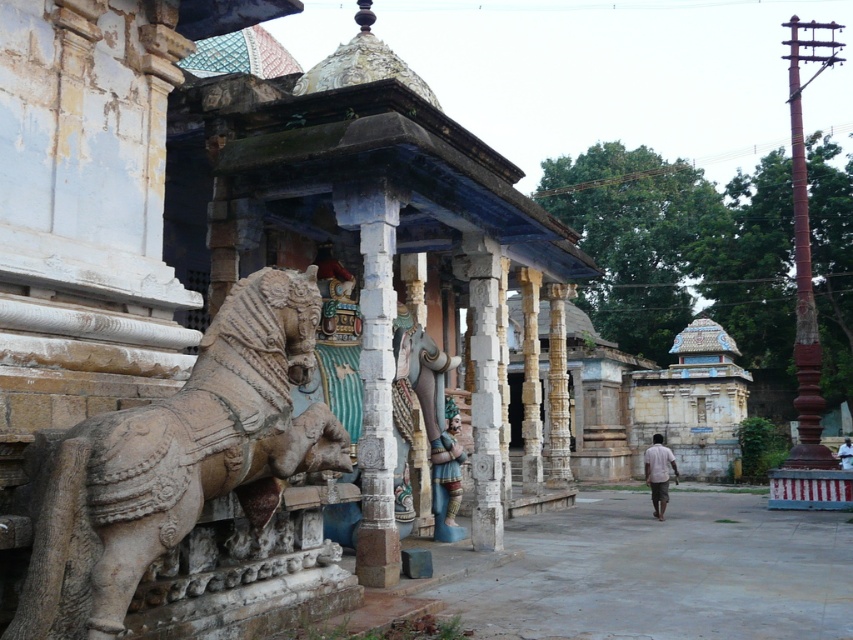
You are standing in front of the temple complex and want to take a photo of the white stone pillar at center and the polychrome painted statue at center. Which object should you focus on first if you want to capture both in a single frame without moving the camera?

You should focus on the white stone pillar at center first because it is closer to the viewer than the polychrome painted statue at center, ensuring both are in focus when using a single focal point.

You are a tourist visiting the temple complex and see the rusty metal pole at right and the light brown cotton shirt at center. Which object is located to the right of the other?

The rusty metal pole at right is positioned on the right side of the light brown cotton shirt at center.

You are standing in front of the temple complex and notice two points marked on the temple structure. The first point is at coordinates point (x=257, y=506), and the second is at point (x=405, y=195). Which of these two points is closer to your current position?

Point (x=257, y=506) is closer to the viewer than point (x=405, y=195).